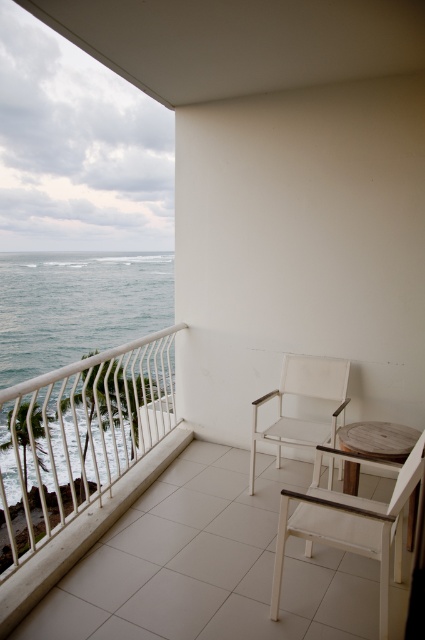
Is white wood chair at lower right to the right of white fabric chair at center from the viewer's perspective?

Yes, white wood chair at lower right is to the right of white fabric chair at center.

Which is in front, point (396, 552) or point (314, 440)?

Point (396, 552)

Image resolution: width=425 pixels, height=640 pixels. Identify the location of white wood chair at lower right. (351, 528).

In the scene shown: Can you confirm if white wood chair at lower right is positioned above wooden table at center?

No.

Does white wood chair at lower right have a lesser height compared to wooden table at center?

Incorrect, white wood chair at lower right's height does not fall short of wooden table at center's.

I want to click on white wood chair at lower right, so click(351, 528).

Between point (340, 477) and point (376, 429), which one is positioned in front?

Point (376, 429) is more forward.

Between white fabric chair at center and wooden table at center, which one is positioned higher?

white fabric chair at center

You are a GUI agent. You are given a task and a screenshot of the screen. Output one action in this format:
    pyautogui.click(x=<x>, y=<y>)
    Task: Click on the white fabric chair at center
    Image resolution: width=425 pixels, height=640 pixels.
    Given the screenshot: What is the action you would take?
    pyautogui.click(x=306, y=396)